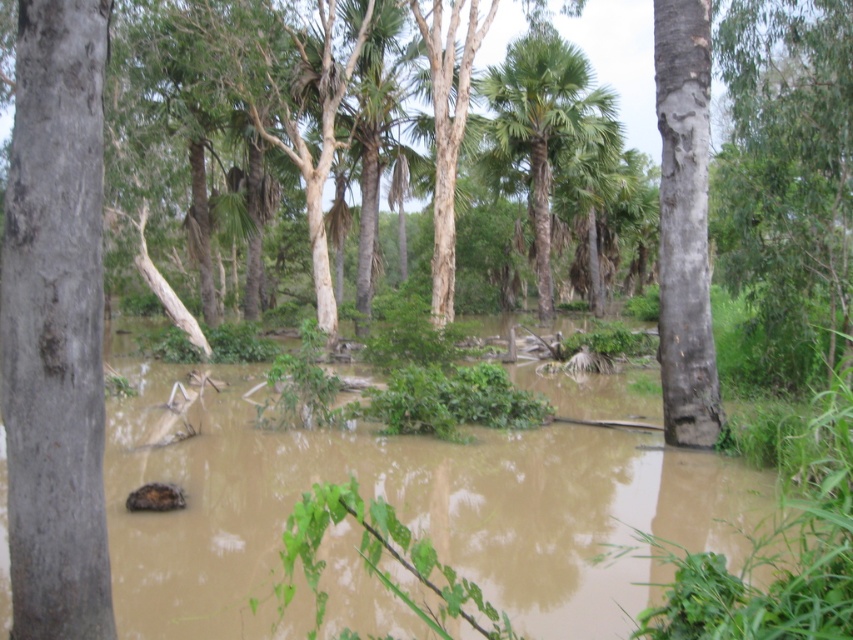
Question: Is gray rough bark tree at left further to camera compared to green leafy palm tree at center?

Choices:
 (A) no
 (B) yes

Answer: (A)

Question: Which point is closer to the camera taking this photo?

Choices:
 (A) (811, 422)
 (B) (567, 44)

Answer: (A)

Question: Does brown muddy water at center appear over smooth gray bark at right?

Choices:
 (A) no
 (B) yes

Answer: (A)

Question: Which point is closer to the camera?

Choices:
 (A) smooth gray bark at right
 (B) green leafy palm tree at center
 (C) gray rough bark tree at left
 (D) brown muddy water at center

Answer: (D)

Question: Where is gray rough bark tree at left located in relation to green leafy palm tree at center in the image?

Choices:
 (A) right
 (B) left

Answer: (B)

Question: Which object appears closest to the camera in this image?

Choices:
 (A) brown muddy water at center
 (B) smooth gray bark at right
 (C) gray rough bark tree at left

Answer: (A)